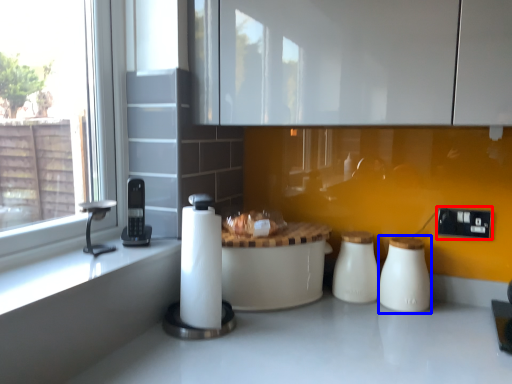
Question: Which object appears closest to the camera in this image, electric outlet (highlighted by a red box) or salt shaker (highlighted by a blue box)?

Choices:
 (A) electric outlet
 (B) salt shaker

Answer: (B)